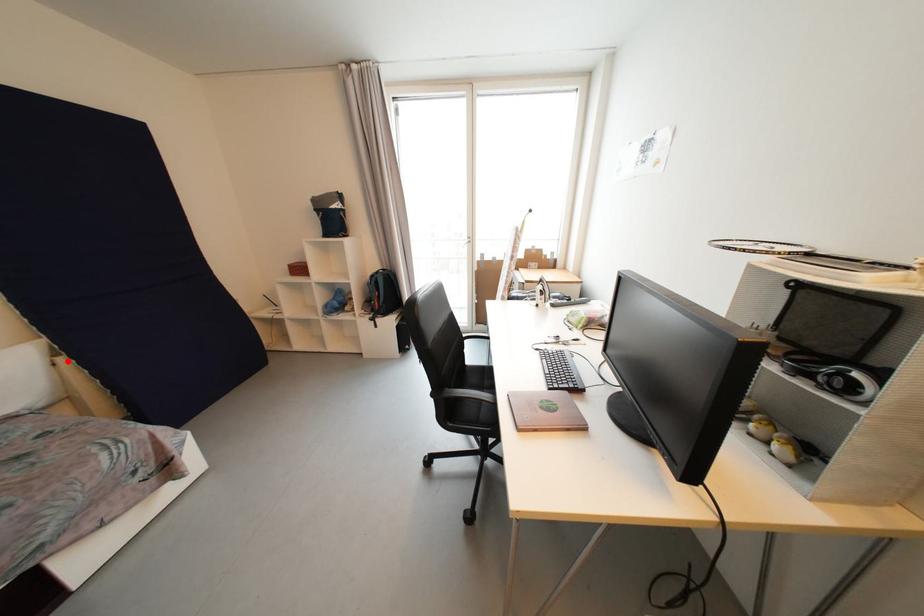
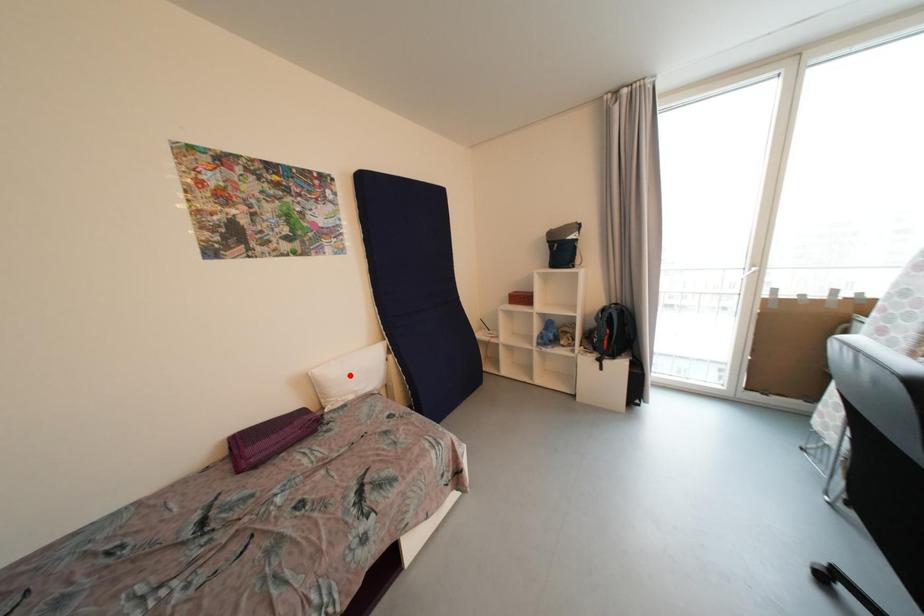
I am providing you with two images of the same scene from different viewpoints. A red point is marked on the first image and another point is marked on the second image. Is the red point in image1 aligned with the point shown in image2?

No